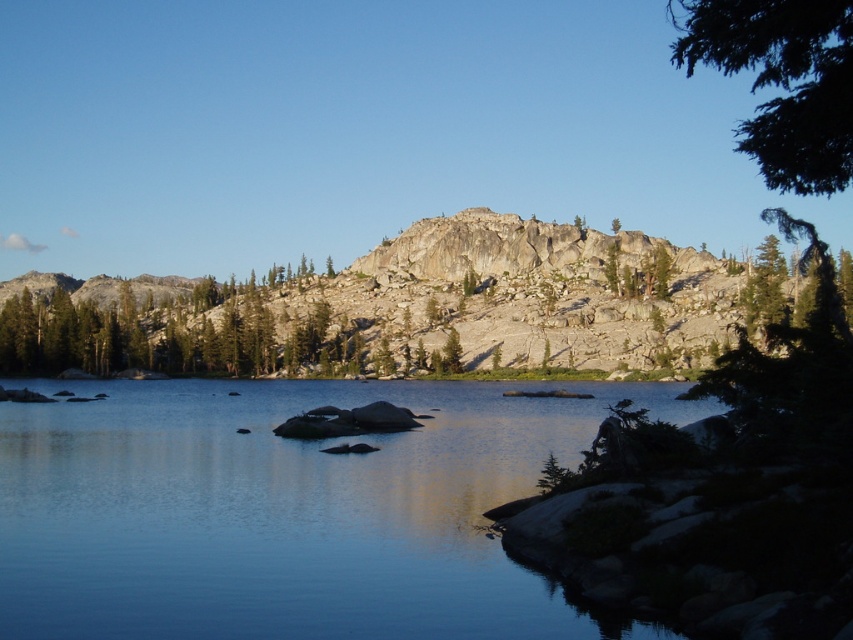
You are a hiker trying to cross the lake. You see the granite rock formation at center and the green textured tree at center. Which object can you step onto first if you start from the shore?

The granite rock formation at center is bigger than the green textured tree at center, so you can step onto the granite rock formation at center first.

From the picture: You are standing at the edge of the lake and see two points marked in the scene. Which point, point (368,516) or point (450,333), is nearer to you?

Point (368,516) is closer to the viewer than point (450,333).

You are standing at the edge of the lake and want to locate the clear water at center. Based on the coordinates provided, in which direction should you look relative to your position?

The clear water at center is located at coordinates 0.800 on the x and 0.338 on the y. Since you are at the edge, looking towards the center of the lake would mean facing towards the clear water at center, which is ahead and slightly to the right based on the coordinates.